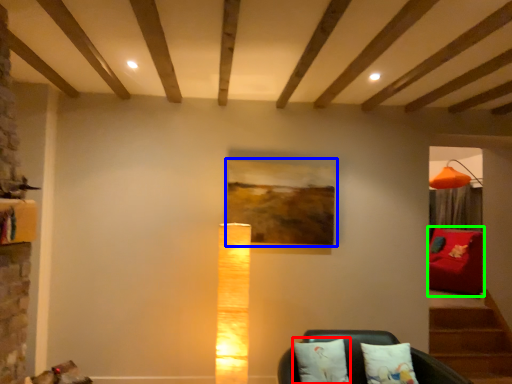
Question: Based on their relative distances, which object is farther from pillow (highlighted by a red box)? Choose from picture frame (highlighted by a blue box) and furniture (highlighted by a green box).

Choices:
 (A) picture frame
 (B) furniture

Answer: (B)